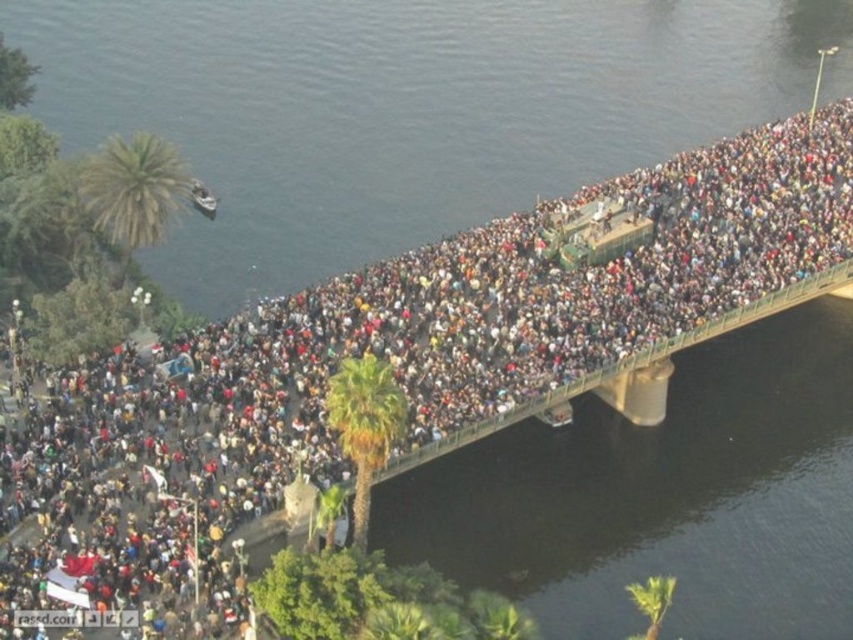
Who is more forward, (646, 637) or (190, 186)?

Positioned in front is point (646, 637).

Based on the photo, can you confirm if green leafy palm tree at lower center is positioned to the right of metallic silver boat at upper left?

Indeed, green leafy palm tree at lower center is positioned on the right side of metallic silver boat at upper left.

Who is more distant from viewer, (x=660, y=621) or (x=202, y=192)?

Point (x=202, y=192)

The width and height of the screenshot is (853, 640). What are the coordinates of `green leafy palm tree at lower center` in the screenshot? It's located at (651, 602).

Is green leafy palm tree at upper left positioned before green leafy palm tree at lower center?

No, green leafy palm tree at upper left is further to the viewer.

Is green leafy palm tree at upper left behind green leafy palm tree at lower center?

That is True.

Describe the element at coordinates (132, 189) in the screenshot. I see `green leafy palm tree at upper left` at that location.

This screenshot has height=640, width=853. What are the coordinates of `green leafy palm tree at upper left` in the screenshot? It's located at (132, 189).

Does dark blue water at center appear under green leafy palm tree at center?

No.

Which is above, dark blue water at center or green leafy palm tree at center?

dark blue water at center is above.

Is point (189, 236) less distant than point (360, 449)?

No, it is not.

You are a GUI agent. You are given a task and a screenshot of the screen. Output one action in this format:
    pyautogui.click(x=<x>, y=<y>)
    Task: Click on the dark blue water at center
    This screenshot has height=640, width=853.
    Given the screenshot: What is the action you would take?
    pyautogui.click(x=404, y=109)